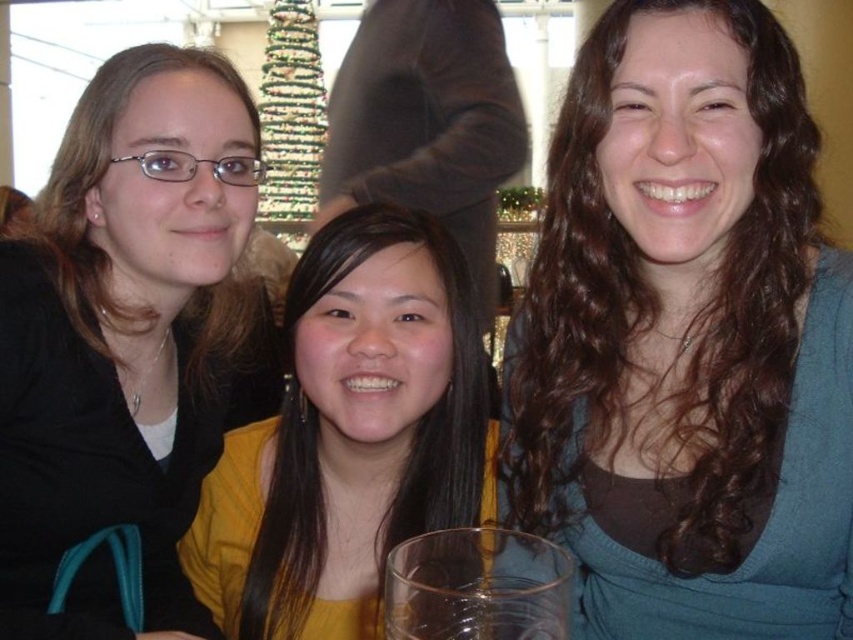
How far apart are brown curly hair at center and yellow matte shirt at center?

brown curly hair at center and yellow matte shirt at center are 9.10 meters apart.

Who is more forward, (547,516) or (421,385)?

Point (547,516) is more forward.

This screenshot has height=640, width=853. Find the location of `brown curly hair at center`. brown curly hair at center is located at coordinates (688, 339).

Who is shorter, matte black hair at left or yellow matte shirt at center?

With less height is yellow matte shirt at center.

This screenshot has width=853, height=640. In order to click on matte black hair at left in this screenshot , I will do `click(128, 342)`.

Which of these two, brown curly hair at center or matte black hair at left, stands shorter?

matte black hair at left is shorter.

Does brown curly hair at center appear over matte black hair at left?

Indeed, brown curly hair at center is positioned over matte black hair at left.

Is point (635, 26) behind point (126, 468)?

No, it is in front of (126, 468).

Find the location of a particular element. brown curly hair at center is located at coordinates (688, 339).